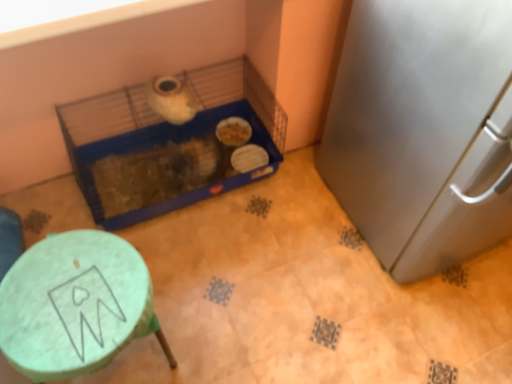
At what (x,y) coordinates should I click in order to perform the action: click on free space behind green matte stool at lower left. Please return your answer as a coordinate pair (x, y). Image resolution: width=512 pixels, height=384 pixels. Looking at the image, I should click on (178, 263).